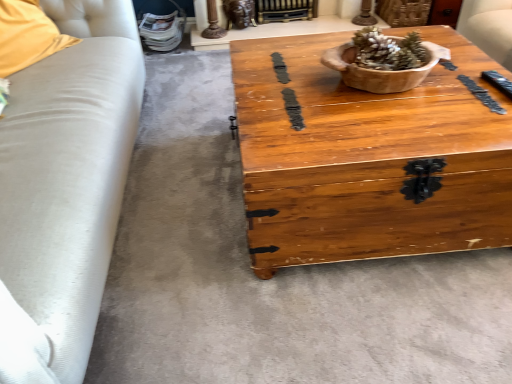
Image resolution: width=512 pixels, height=384 pixels. In order to click on gold metallic fireplace at upper center in this screenshot , I will do `click(285, 10)`.

This screenshot has height=384, width=512. Describe the element at coordinates (365, 162) in the screenshot. I see `wooden chest at center` at that location.

Locate an element on the screen. This screenshot has width=512, height=384. gold metallic fireplace at upper center is located at coordinates (285, 10).

From a real-world perspective, which is physically below, wooden chest at center or gold metallic fireplace at upper center?

gold metallic fireplace at upper center, from a real-world perspective.

Which of these two, wooden chest at center or gold metallic fireplace at upper center, is thinner?

With smaller width is gold metallic fireplace at upper center.

Based on their sizes in the image, would you say wooden chest at center is bigger or smaller than gold metallic fireplace at upper center?

Considering their sizes, wooden chest at center takes up more space than gold metallic fireplace at upper center.

How distant is wooden chest at center from gold metallic fireplace at upper center?

wooden chest at center is 6.65 feet from gold metallic fireplace at upper center.

This screenshot has height=384, width=512. In order to click on pillow directly beneath the wooden bowl at center (from a real-world perspective) in this screenshot , I will do `click(27, 35)`.

Is wooden bowl at center positioned far away from soft yellow fabric pillow at left?

Yes, wooden bowl at center is far from soft yellow fabric pillow at left.

In the image, is wooden bowl at center positioned in front of or behind soft yellow fabric pillow at left?

Clearly, wooden bowl at center is in front of soft yellow fabric pillow at left.

Considering the positions of objects wooden bowl at center and soft yellow fabric pillow at left in the image provided, who is more to the right, wooden bowl at center or soft yellow fabric pillow at left?

wooden bowl at center.

Who is smaller, gold metallic fireplace at upper center or soft yellow fabric pillow at left?

Smaller between the two is gold metallic fireplace at upper center.

From a real-world perspective, which is physically below, gold metallic fireplace at upper center or soft yellow fabric pillow at left?

gold metallic fireplace at upper center is physically lower.

Is gold metallic fireplace at upper center not within soft yellow fabric pillow at left?

Yes, gold metallic fireplace at upper center is outside of soft yellow fabric pillow at left.

Which is behind, gold metallic fireplace at upper center or soft yellow fabric pillow at left?

Positioned behind is gold metallic fireplace at upper center.

Which is farther from the camera, (62, 46) or (351, 69)?

The point (62, 46) is farther.

Is soft yellow fabric pillow at left beside wooden bowl at center?

They are not placed beside each other.

Is soft yellow fabric pillow at left aimed at wooden bowl at center?

Yes, soft yellow fabric pillow at left is turned towards wooden bowl at center.

Considering the positions of objects soft yellow fabric pillow at left and wooden bowl at center in the image provided, who is more to the right, soft yellow fabric pillow at left or wooden bowl at center?

From the viewer's perspective, wooden bowl at center appears more on the right side.

How distant is gold metallic fireplace at upper center from wooden chest at center?

The distance of gold metallic fireplace at upper center from wooden chest at center is 6.65 feet.

Between point (309, 6) and point (430, 107), which one is positioned behind?

Point (309, 6)

Locate an element on the screen. The image size is (512, 384). coffee table above the gold metallic fireplace at upper center (from a real-world perspective) is located at coordinates (365, 162).

In terms of width, does gold metallic fireplace at upper center look wider or thinner when compared to wooden chest at center?

Clearly, gold metallic fireplace at upper center has less width compared to wooden chest at center.

Is soft yellow fabric pillow at left inside wooden chest at center?

No, wooden chest at center does not contain soft yellow fabric pillow at left.

Looking at the image, does wooden chest at center seem bigger or smaller compared to soft yellow fabric pillow at left?

Considering their sizes, wooden chest at center takes up more space than soft yellow fabric pillow at left.

Considering the positions of objects wooden chest at center and soft yellow fabric pillow at left in the image provided, who is behind, wooden chest at center or soft yellow fabric pillow at left?

soft yellow fabric pillow at left is more distant.

In the image, is gold metallic fireplace at upper center on the left side or the right side of wooden bowl at center?

Based on their positions, gold metallic fireplace at upper center is located to the left of wooden bowl at center.

Is gold metallic fireplace at upper center positioned beyond the bounds of wooden bowl at center?

Indeed, gold metallic fireplace at upper center is completely outside wooden bowl at center.

Which of these two, gold metallic fireplace at upper center or wooden bowl at center, stands shorter?

With less height is wooden bowl at center.

Who is more distant, gold metallic fireplace at upper center or wooden bowl at center?

gold metallic fireplace at upper center is further from the camera.

Locate an element on the screen. The image size is (512, 384). fireplace located behind the wooden chest at center is located at coordinates (285, 10).

The height and width of the screenshot is (384, 512). In order to click on pillow that is under the wooden bowl at center (from a real-world perspective) in this screenshot , I will do `click(27, 35)`.

Which object lies further to the anchor point soft yellow fabric pillow at left, wooden chest at center or wooden bowl at center?

The object further to soft yellow fabric pillow at left is wooden bowl at center.

From the image, which object appears to be nearer to wooden bowl at center, gold metallic fireplace at upper center or wooden chest at center?

wooden chest at center.

Looking at the image, which one is located closer to wooden chest at center, gold metallic fireplace at upper center or wooden bowl at center?

wooden bowl at center is closer to wooden chest at center.

From the image, which object appears to be farther from wooden chest at center, gold metallic fireplace at upper center or soft yellow fabric pillow at left?

The object further to wooden chest at center is gold metallic fireplace at upper center.

When comparing their distances from wooden chest at center, does wooden bowl at center or soft yellow fabric pillow at left seem closer?

The object closer to wooden chest at center is wooden bowl at center.

Which object lies further to the anchor point soft yellow fabric pillow at left, wooden bowl at center or wooden chest at center?

wooden bowl at center is further to soft yellow fabric pillow at left.

Based on their spatial positions, is wooden chest at center or gold metallic fireplace at upper center further from soft yellow fabric pillow at left?

The object further to soft yellow fabric pillow at left is gold metallic fireplace at upper center.

When comparing their distances from soft yellow fabric pillow at left, does gold metallic fireplace at upper center or wooden bowl at center seem further?

The object further to soft yellow fabric pillow at left is gold metallic fireplace at upper center.

Identify the location of pillow between wooden chest at center and gold metallic fireplace at upper center in the front-back direction. (27, 35).

The height and width of the screenshot is (384, 512). In order to click on pillow between wooden bowl at center and gold metallic fireplace at upper center in the front-back direction in this screenshot , I will do `click(27, 35)`.

Identify the location of flowerpot between wooden chest at center and gold metallic fireplace at upper center along the z-axis. This screenshot has height=384, width=512. (380, 71).

I want to click on coffee table between soft yellow fabric pillow at left and wooden bowl at center in the horizontal direction, so click(365, 162).